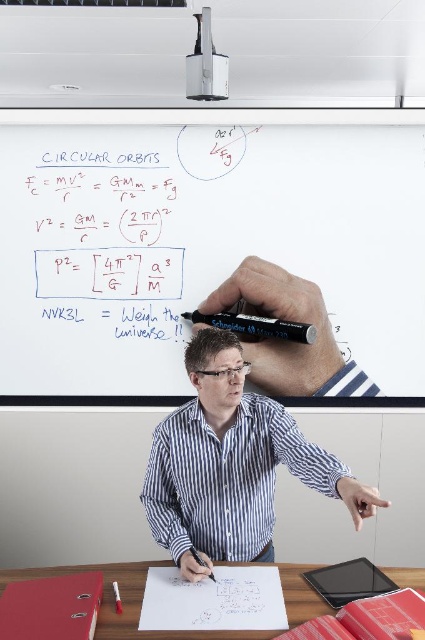
Question: Does white striped shirt at center appear under black marker pen at center?

Choices:
 (A) yes
 (B) no

Answer: (B)

Question: Among these points, which one is nearest to the camera?

Choices:
 (A) (220, 285)
 (B) (353, 486)

Answer: (B)

Question: Is black matte marker at upper center positioned in front of black marker pen at center?

Choices:
 (A) no
 (B) yes

Answer: (B)

Question: Which point is closer to the camera?

Choices:
 (A) (113, 611)
 (B) (261, 376)
 (C) (189, 317)

Answer: (A)

Question: Is black marker at upper center above black marker pen at center?

Choices:
 (A) yes
 (B) no

Answer: (A)

Question: Which point is farther to the camera?

Choices:
 (A) white striped shirt at center
 (B) wooden table at lower center
 (C) whiteboard at upper center
 (D) black matte marker at upper center

Answer: (C)